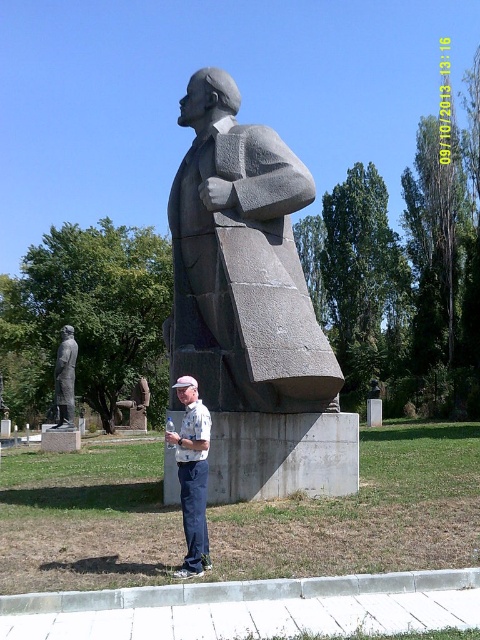
Question: Among these objects, which one is nearest to the camera?

Choices:
 (A) gray stone bust at center
 (B) white cotton shirt at center

Answer: (B)

Question: Is gray stone bust at center to the right of white cotton shirt at center from the viewer's perspective?

Choices:
 (A) yes
 (B) no

Answer: (B)

Question: Is white cotton shirt at center thinner than polished bronze statue at lower left?

Choices:
 (A) yes
 (B) no

Answer: (A)

Question: Which of the following is the farthest from the observer?

Choices:
 (A) white cotton shirt at center
 (B) polished bronze statue at lower left
 (C) gray stone bust at center

Answer: (B)

Question: Which point is closer to the camera?

Choices:
 (A) [180, 209]
 (B) [182, 456]
 (C) [60, 380]

Answer: (B)

Question: Can you confirm if gray stone bust at center is wider than polished bronze statue at lower left?

Choices:
 (A) yes
 (B) no

Answer: (B)